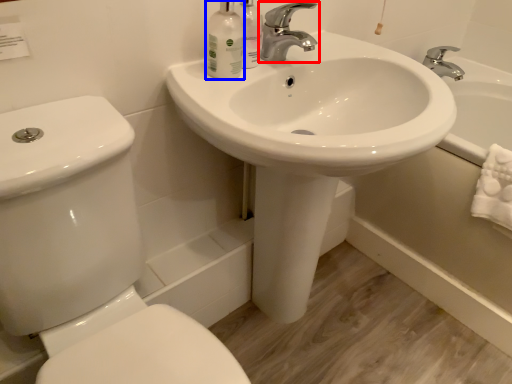
Question: Which object appears farthest to the camera in this image, tap (highlighted by a red box) or mouthwash (highlighted by a blue box)?

Choices:
 (A) tap
 (B) mouthwash

Answer: (A)